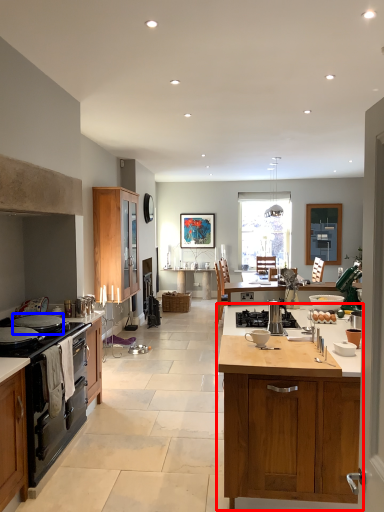
Question: Which of the following is the closest to the observer, cabinetry (highlighted by a red box) or appliance (highlighted by a blue box)?

Choices:
 (A) cabinetry
 (B) appliance

Answer: (A)